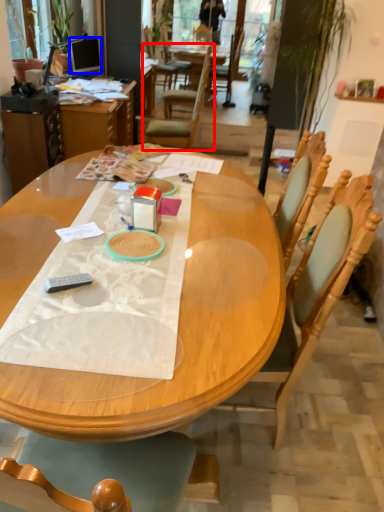
Question: Which object appears farthest to the camera in this image, chair (highlighted by a red box) or television (highlighted by a blue box)?

Choices:
 (A) chair
 (B) television

Answer: (B)